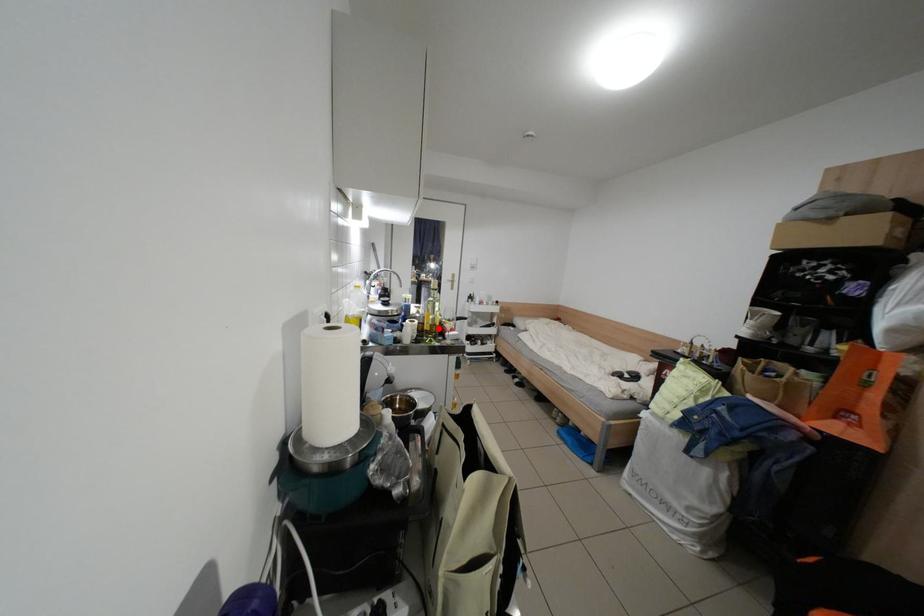
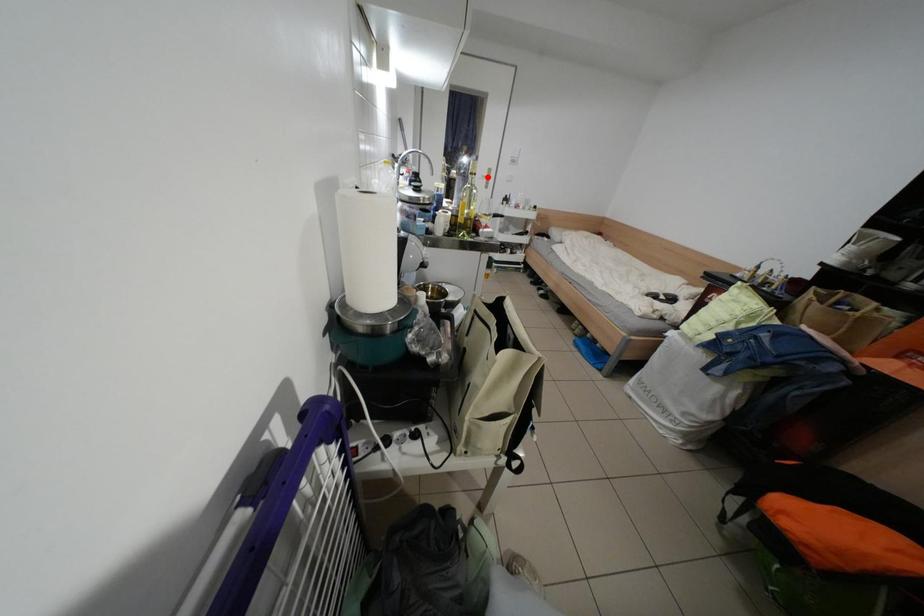
I am providing you with two images of the same scene from different viewpoints. A red point is marked on the first image and another point is marked on the second image. Is the marked point in image1 the same physical position as the marked point in image2?

No